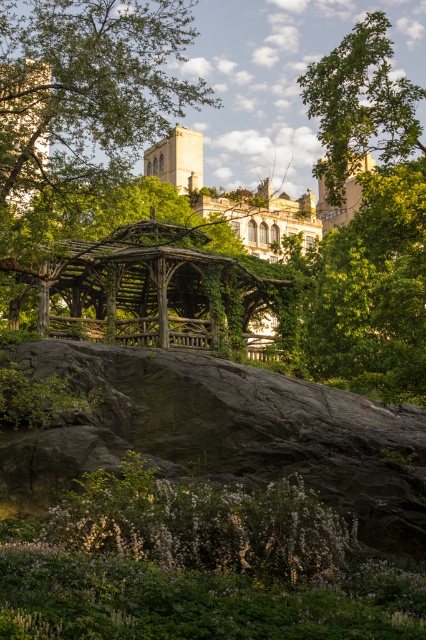
Is dark gray rock at center bigger than green leafy tree at upper right?

No.

Is dark gray rock at center shorter than green leafy tree at upper right?

Indeed, dark gray rock at center has a lesser height compared to green leafy tree at upper right.

Does point (175, 355) come behind point (373, 136)?

Yes, it is behind point (373, 136).

I want to click on dark gray rock at center, so click(219, 433).